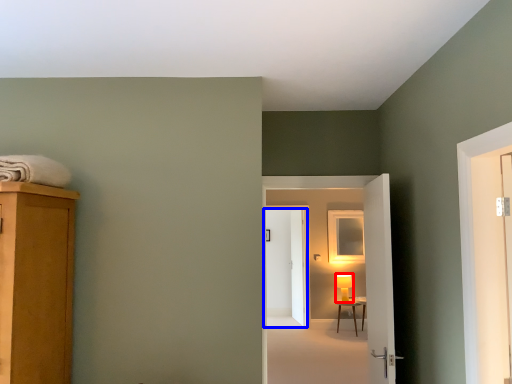
Question: Among these objects, which one is farthest to the camera, table lamp (highlighted by a red box) or door (highlighted by a blue box)?

Choices:
 (A) table lamp
 (B) door

Answer: (B)